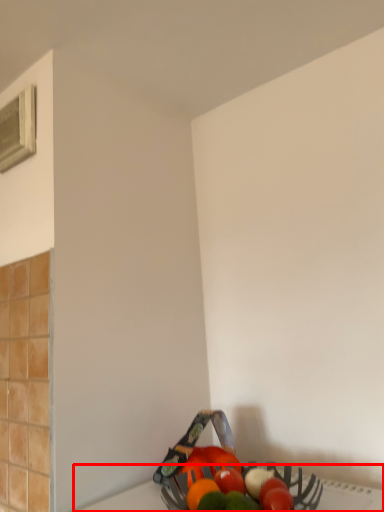
Question: In this image, where is table top (annotated by the red box) located relative to window?

Choices:
 (A) right
 (B) left

Answer: (A)